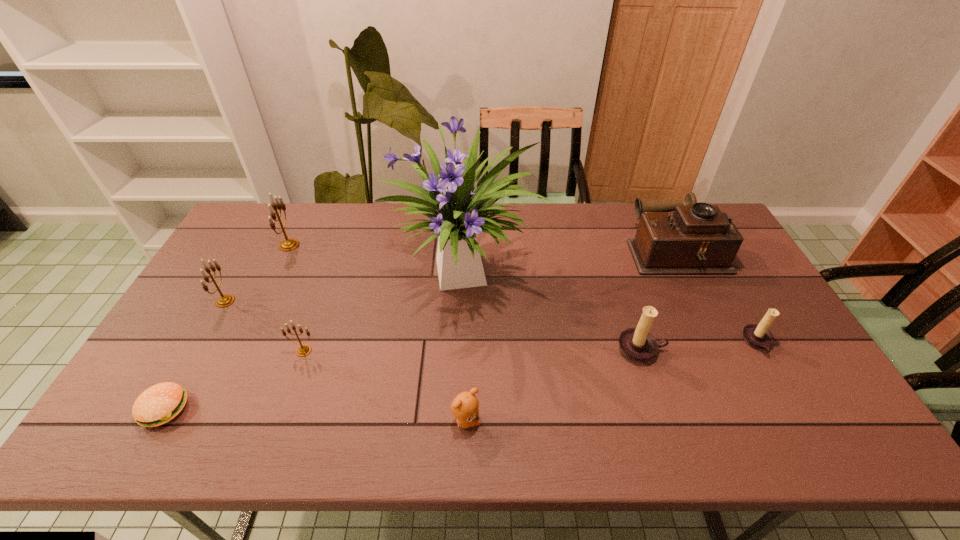
What are the coordinates of `free spot between the shortest object and the right brown candle holder` in the screenshot? It's located at [461, 376].

Where is `vacant space that is in between the phonograph_record and the brown teddy bear`? The height and width of the screenshot is (540, 960). vacant space that is in between the phonograph_record and the brown teddy bear is located at coordinates (573, 336).

The width and height of the screenshot is (960, 540). In order to click on vacant region between the second gold candelabrum from left to right and the brown teddy bear in this screenshot , I will do `click(377, 333)`.

The height and width of the screenshot is (540, 960). I want to click on the eighth closest object to the third candelabrum from right to left, so 757,336.

Where is `object that is the sixth closest to the farthest candelabrum`? This screenshot has width=960, height=540. object that is the sixth closest to the farthest candelabrum is located at coordinates (637, 344).

This screenshot has height=540, width=960. I want to click on candelabrum that is the fifth closest to the patty, so click(x=757, y=336).

Find the location of a particular element. candelabrum that is the second closest to the teddy bear is located at coordinates (303, 350).

Locate an element on the screen. Image resolution: width=960 pixels, height=540 pixels. gold candelabrum object that ranks as the third closest to the phonograph_record is located at coordinates (225, 300).

This screenshot has height=540, width=960. In order to click on gold candelabrum that is the closest to the nearest gold candelabrum in this screenshot , I will do pyautogui.click(x=225, y=300).

At what (x,y) coordinates should I click in order to perform the action: click on free space that satisfies the following two spatial constraints: 1. on the wick of the bigger brown candle holder; 2. on the face of the teddy bear. Please return your answer as a coordinate pair (x, y). Looking at the image, I should click on (664, 421).